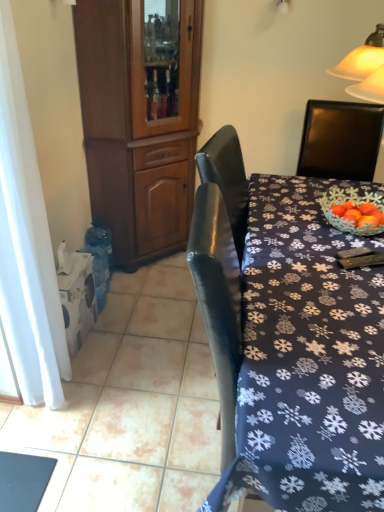
The height and width of the screenshot is (512, 384). Find the location of `vacant area on the back side of white sheer curtain at left`. vacant area on the back side of white sheer curtain at left is located at coordinates (90, 355).